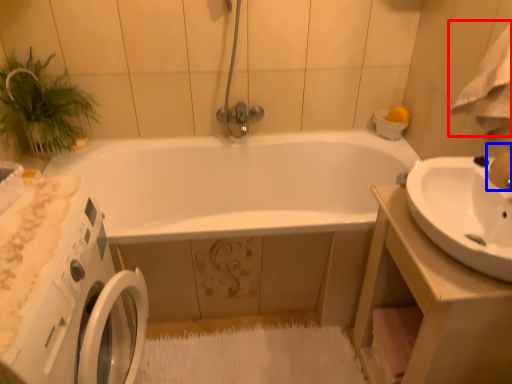
Question: Which object is further to the camera taking this photo, bath towel (highlighted by a red box) or faucet (highlighted by a blue box)?

Choices:
 (A) bath towel
 (B) faucet

Answer: (B)